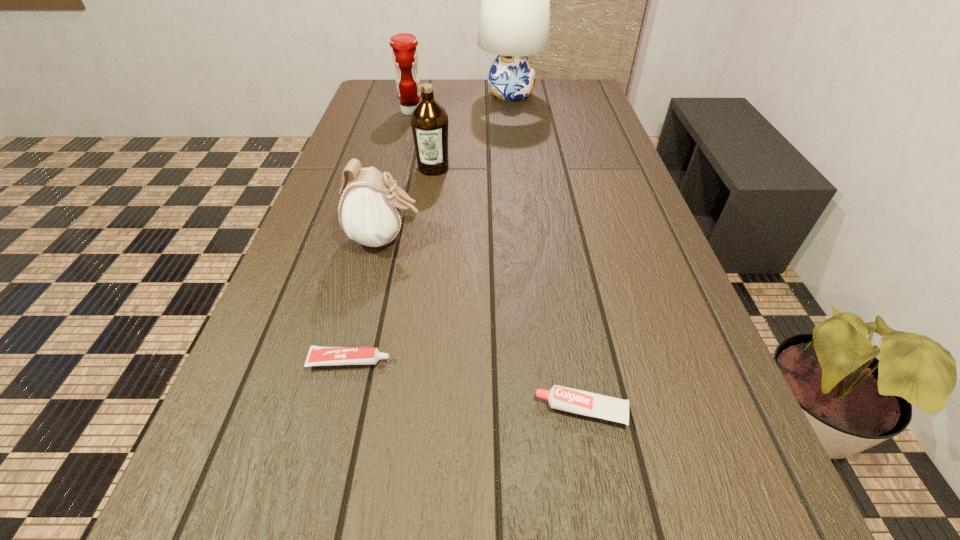
Identify the location of vacant space located on the front-facing side of the tallest object. (x=382, y=94).

The image size is (960, 540). In order to click on vacant region located on the front-facing side of the tallest object in this screenshot , I will do `click(426, 94)`.

You are a GUI agent. You are given a task and a screenshot of the screen. Output one action in this format:
    pyautogui.click(x=<x>, y=<y>)
    Task: Click on the vacant space positioned 0.390m on the right of the condiment
    This screenshot has width=960, height=540.
    Given the screenshot: What is the action you would take?
    pyautogui.click(x=548, y=111)

Where is `vacant space located on the label of the olive oil`? This screenshot has width=960, height=540. vacant space located on the label of the olive oil is located at coordinates (423, 241).

Find the location of a particular element. free space located 0.070m on the front-facing side of the pouch is located at coordinates (456, 239).

Image resolution: width=960 pixels, height=540 pixels. What are the coordinates of `free space located 0.380m on the back of the right toothpaste` in the screenshot? It's located at (551, 235).

Where is `vacant space located 0.210m at the nozzle of the farther toothpaste`? Image resolution: width=960 pixels, height=540 pixels. vacant space located 0.210m at the nozzle of the farther toothpaste is located at coordinates (516, 361).

Image resolution: width=960 pixels, height=540 pixels. What are the coordinates of `lampshade that is at the far edge` in the screenshot? It's located at (514, 22).

This screenshot has width=960, height=540. Identify the location of condiment located at the far edge. (405, 56).

The height and width of the screenshot is (540, 960). Identify the location of condiment positioned at the left edge. (405, 56).